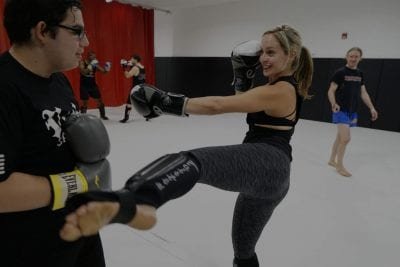
At what (x,y) coordinates should I click in order to perform the action: click on white upper half of wall. Please return your answer as a coordinate pair (x, y). Looking at the image, I should click on (205, 30).